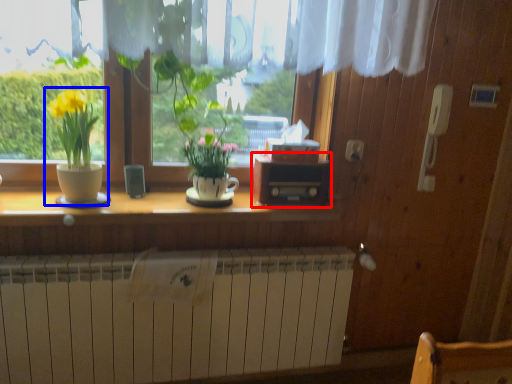
Question: Which point is closer to the camera, window box (highlighted by a red box) or houseplant (highlighted by a blue box)?

Choices:
 (A) window box
 (B) houseplant

Answer: (B)